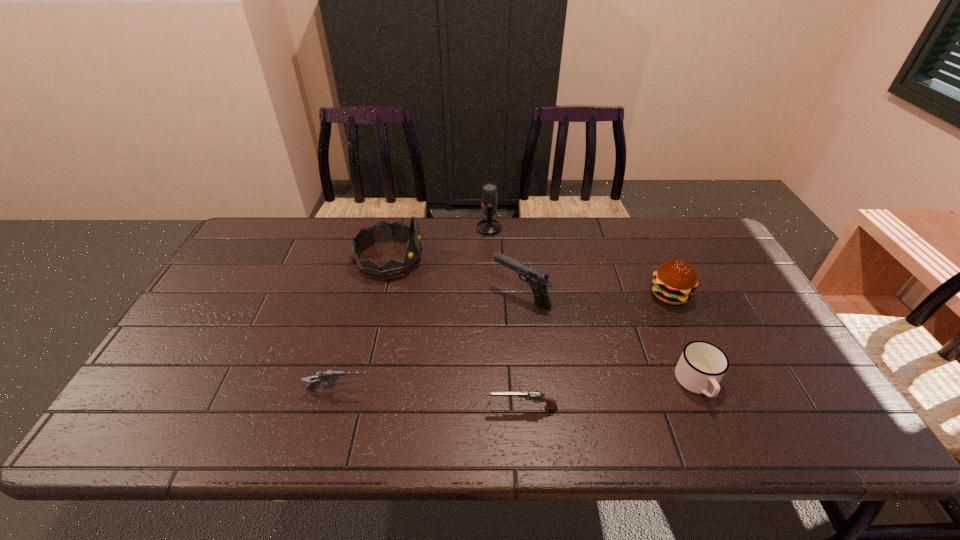
I want to click on vacant space located 0.090m aiming along the barrel of the shortest object, so click(449, 409).

What are the coordinates of `microphone that is at the far edge` in the screenshot? It's located at (489, 226).

You are a GUI agent. You are given a task and a screenshot of the screen. Output one action in this format:
    pyautogui.click(x=<x>, y=<y>)
    Task: Click on the tiara at the far edge
    This screenshot has height=540, width=960.
    Given the screenshot: What is the action you would take?
    pyautogui.click(x=382, y=231)

At what (x,y) coordinates should I click in order to perform the action: click on object situated at the near edge. Please return your answer as a coordinate pair (x, y). This screenshot has width=960, height=540. Looking at the image, I should click on (536, 396).

At what (x,y) coordinates should I click in order to perform the action: click on vacant space at the far edge. Please return your answer as a coordinate pair (x, y). The width and height of the screenshot is (960, 540). Looking at the image, I should click on (638, 241).

Where is `vacant space at the near edge of the desktop`? This screenshot has height=540, width=960. vacant space at the near edge of the desktop is located at coordinates (283, 415).

Identify the location of vacant area at the left edge of the desktop. The width and height of the screenshot is (960, 540). (256, 289).

What are the coordinates of `free space at the right edge of the desktop` in the screenshot? It's located at (734, 315).

You are a GUI agent. You are given a task and a screenshot of the screen. Output one action in this format:
    pyautogui.click(x=<x>, y=<y>)
    Task: Click on the free space at the far left corner
    The image size is (960, 540).
    Given the screenshot: What is the action you would take?
    pyautogui.click(x=269, y=222)

The image size is (960, 540). In the image, there is a desktop. Identify the location of vacant space at the far right corner. (707, 245).